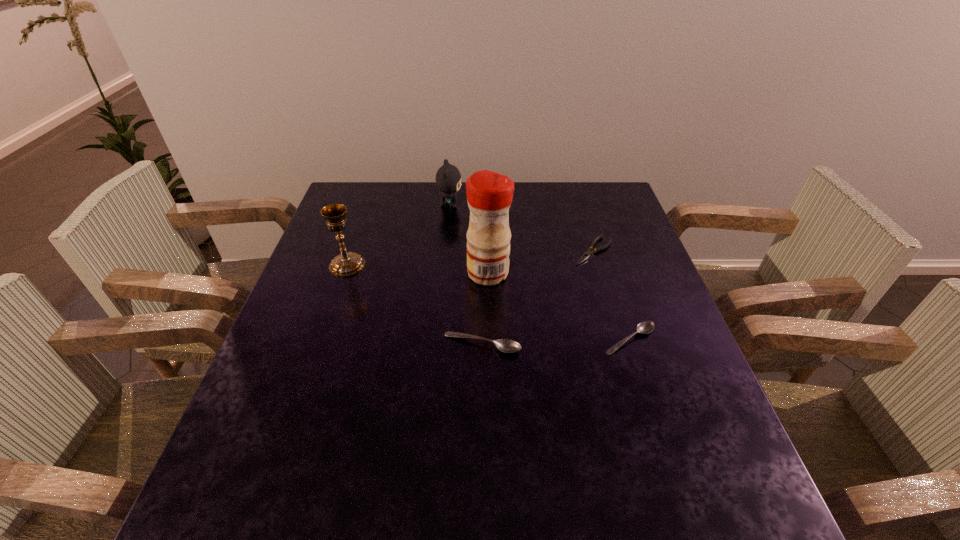
Find the location of `free space at the near edge of the desktop`. free space at the near edge of the desktop is located at coordinates (330, 421).

In the image, there is a desktop. Find the location of `vacant space at the left edge`. vacant space at the left edge is located at coordinates (269, 387).

Identify the location of vacant space at the right edge of the desktop. The height and width of the screenshot is (540, 960). (631, 266).

Locate an element on the screen. This screenshot has height=540, width=960. free spot at the far right corner of the desktop is located at coordinates (582, 185).

You are a GUI agent. You are given a task and a screenshot of the screen. Output one action in this format:
    pyautogui.click(x=<x>, y=<y>)
    Task: Click on the empty space between the chalice and the left soupspoon
    The height and width of the screenshot is (540, 960).
    Given the screenshot: What is the action you would take?
    pyautogui.click(x=415, y=305)

Where is `vacant area between the kitten and the third shortest object`? This screenshot has width=960, height=540. vacant area between the kitten and the third shortest object is located at coordinates (466, 275).

The image size is (960, 540). In order to click on free space between the fourth tallest object and the chalice in this screenshot , I will do `click(415, 305)`.

In order to click on vacant area that lies between the fifth shortest object and the shorter soupspoon in this screenshot , I will do `click(489, 302)`.

Locate an element on the screen. vacant area between the pliers and the kitten is located at coordinates (521, 228).

Locate an element on the screen. This screenshot has height=540, width=960. vacant space that is in between the right soupspoon and the condiment is located at coordinates (559, 306).